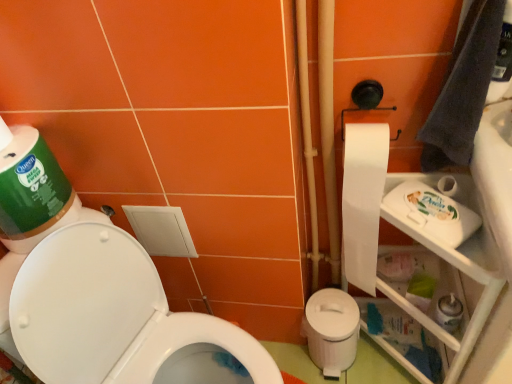
Question: Is white plastic shelf at right inside the boundaries of white plastic potty at lower right, or outside?

Choices:
 (A) outside
 (B) inside

Answer: (A)

Question: Considering the relative positions of white plastic shelf at right and white plastic potty at lower right in the image provided, is white plastic shelf at right to the left or to the right of white plastic potty at lower right?

Choices:
 (A) right
 (B) left

Answer: (A)

Question: Estimate the real-world distances between objects in this image. Which object is closer to the gray fabric hand towel at upper right?

Choices:
 (A) white glossy toilet at lower left
 (B) white plastic shelf at right
 (C) white paper at right
 (D) white plastic potty at lower right
 (E) white glossy sink at upper right

Answer: (E)

Question: Which object is positioned farthest from the white paper at right?

Choices:
 (A) white plastic potty at lower right
 (B) white plastic shelf at right
 (C) gray fabric hand towel at upper right
 (D) white glossy sink at upper right
 (E) white glossy toilet at lower left

Answer: (E)